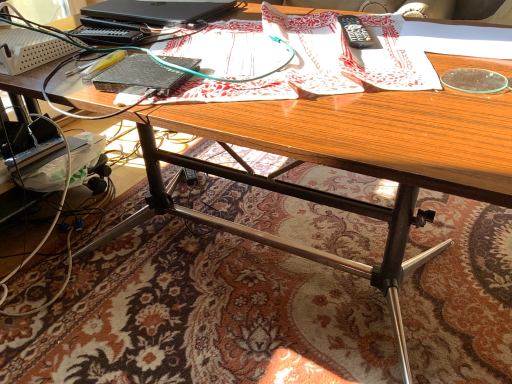
Question: From a real-world perspective, is patterned paper at center located beneath black matte laptop at upper left?

Choices:
 (A) no
 (B) yes

Answer: (B)

Question: Is patterned paper at center not inside black matte laptop at upper left?

Choices:
 (A) yes
 (B) no

Answer: (A)

Question: Considering the relative sizes of patterned paper at center and black matte laptop at upper left in the image provided, is patterned paper at center shorter than black matte laptop at upper left?

Choices:
 (A) yes
 (B) no

Answer: (B)

Question: Considering the relative positions of patterned paper at center and black matte laptop at upper left in the image provided, is patterned paper at center to the right of black matte laptop at upper left from the viewer's perspective?

Choices:
 (A) yes
 (B) no

Answer: (A)

Question: From a real-world perspective, is patterned paper at center positioned over black matte laptop at upper left based on gravity?

Choices:
 (A) yes
 (B) no

Answer: (B)

Question: Looking at the image, does black plastic remote control at upper right seem bigger or smaller compared to black matte laptop at upper left?

Choices:
 (A) big
 (B) small

Answer: (B)

Question: From the image's perspective, is black plastic remote control at upper right positioned above or below black matte laptop at upper left?

Choices:
 (A) below
 (B) above

Answer: (A)

Question: From a real-world perspective, is black plastic remote control at upper right above or below black matte laptop at upper left?

Choices:
 (A) below
 (B) above

Answer: (A)

Question: In the image, is black plastic remote control at upper right positioned in front of or behind black matte laptop at upper left?

Choices:
 (A) behind
 (B) front

Answer: (B)

Question: From a real-world perspective, is black plastic remote control at upper right above or below patterned paper at center?

Choices:
 (A) below
 (B) above

Answer: (A)

Question: In terms of width, does black plastic remote control at upper right look wider or thinner when compared to patterned paper at center?

Choices:
 (A) thin
 (B) wide

Answer: (A)

Question: From the image's perspective, is black plastic remote control at upper right above or below patterned paper at center?

Choices:
 (A) below
 (B) above

Answer: (B)

Question: Is black plastic remote control at upper right taller or shorter than patterned paper at center?

Choices:
 (A) tall
 (B) short

Answer: (B)

Question: Is patterned paper at center in front of or behind black matte laptop at upper left in the image?

Choices:
 (A) front
 (B) behind

Answer: (A)

Question: Which is correct: patterned paper at center is inside black matte laptop at upper left, or outside of it?

Choices:
 (A) inside
 (B) outside

Answer: (B)